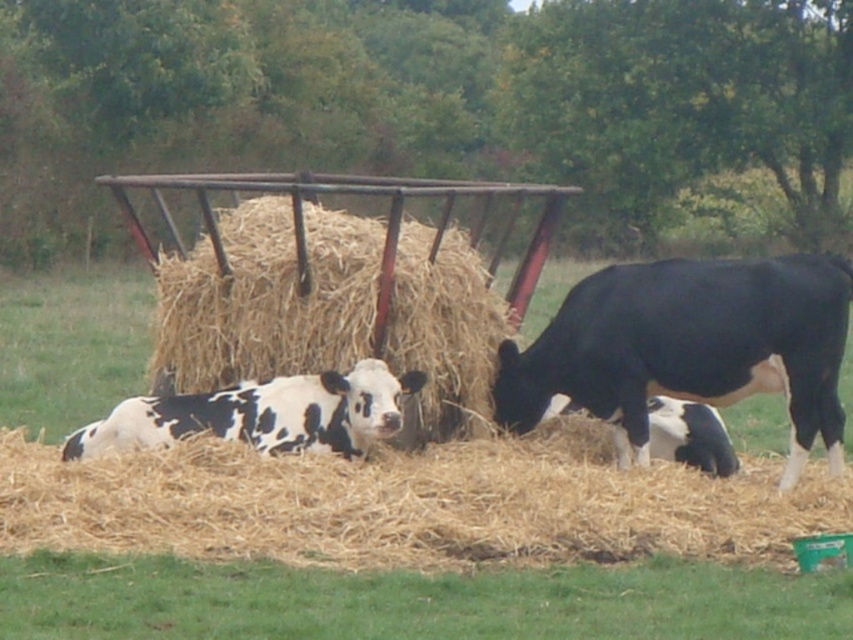
From the picture: You are standing in the field and want to place a small flag at the point closer to you between point [335,528] and point [190,618]. Which point should you choose?

You should choose point [335,528] because it is closer to you than point [190,618].

From the picture: You are a farmer checking the hay feeder in the field. You see the light brown straw at center and the black glossy cow at right. Which object is positioned lower in the image?

The light brown straw at center is located below the black glossy cow at right, so it is positioned lower in the image.

You are a farmer checking the hay feeder in the field. You notice the light brown straw at center and the black and white spotted calf at center. Which object is wider?

The light brown straw at center is wider than the black and white spotted calf at center.